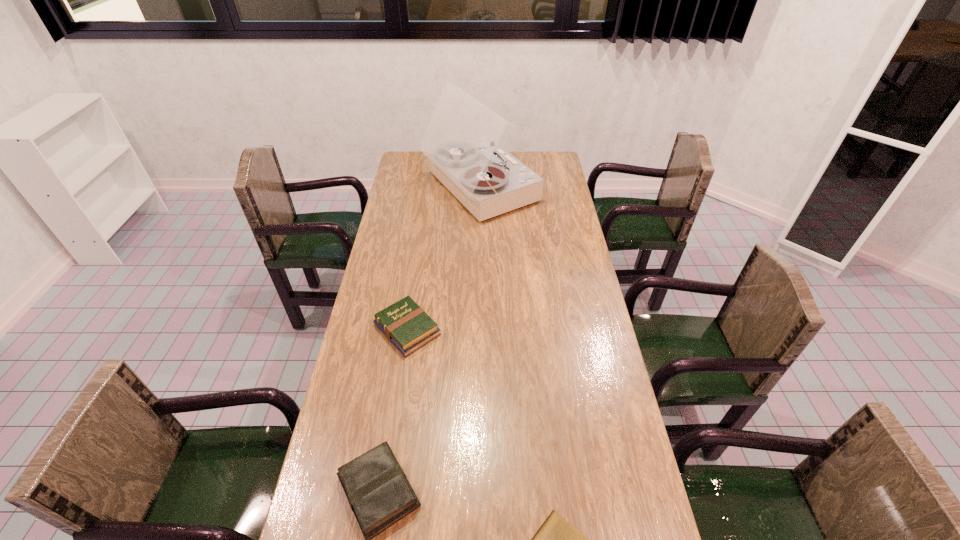
In order to click on the third closest object to the shortest book in this screenshot , I will do `click(461, 140)`.

What are the coordinates of `book that is the closest to the tallest object` in the screenshot? It's located at (406, 325).

Select which book is the closest to the farthest object. Please provide its 2D coordinates. Your answer should be formatted as a tuple, i.e. [(x, y)], where the tuple contains the x and y coordinates of a point satisfying the conditions above.

[(406, 325)]

At what (x,y) coordinates should I click in order to perform the action: click on free space that satisfies the following two spatial constraints: 1. on the back side of the farthest object; 2. on the right side of the third nearest object. Please return your answer as a coordinate pair (x, y). This screenshot has height=540, width=960. Looking at the image, I should click on (429, 188).